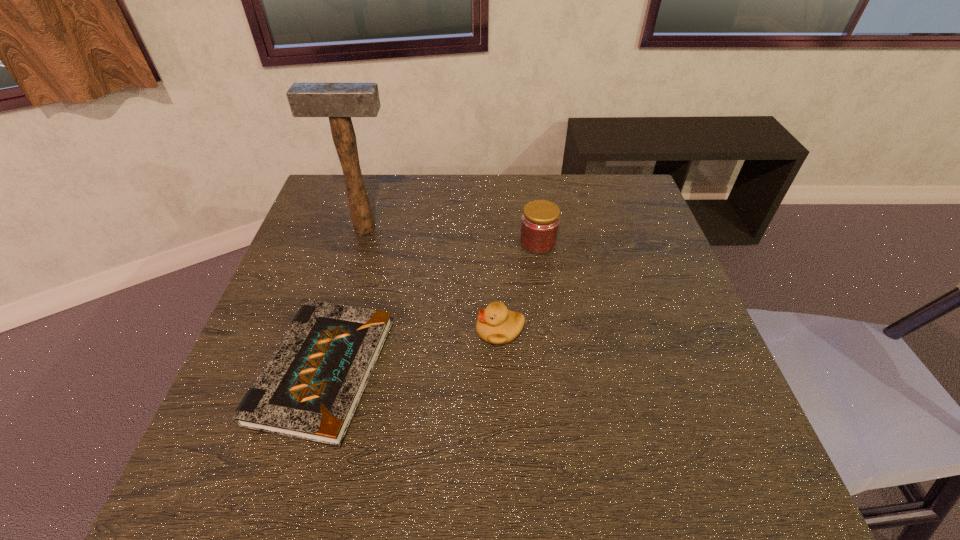
I want to click on vacant space in between the notebook and the jam, so click(x=430, y=307).

Locate which object is the second closest to the second shortest object. Please provide its 2D coordinates. Your answer should be formatted as a tuple, i.e. [(x, y)], where the tuple contains the x and y coordinates of a point satisfying the conditions above.

[(540, 221)]

This screenshot has width=960, height=540. What are the coordinates of `object that is the second closest one to the third tallest object` in the screenshot? It's located at (540, 221).

Locate an element on the screen. The image size is (960, 540). free region that satisfies the following two spatial constraints: 1. on the front side of the mallet; 2. on the right side of the shortest object is located at coordinates (322, 371).

This screenshot has height=540, width=960. Identify the location of vacant position in the image that satisfies the following two spatial constraints: 1. at the beak of the second object from right to left; 2. on the front side of the shortest object. (501, 371).

Where is `blank space that satisfies the following two spatial constraints: 1. on the back side of the rightmost object; 2. on the left side of the notebook`? blank space that satisfies the following two spatial constraints: 1. on the back side of the rightmost object; 2. on the left side of the notebook is located at coordinates (361, 243).

At what (x,y) coordinates should I click in order to perform the action: click on vacant point that satisfies the following two spatial constraints: 1. on the front side of the shortest object; 2. on the right side of the tallest object. Please return your answer as a coordinate pair (x, y). This screenshot has height=540, width=960. Looking at the image, I should click on (322, 371).

Find the location of a particular element. free spot that satisfies the following two spatial constraints: 1. on the front side of the shortest object; 2. on the left side of the mallet is located at coordinates (322, 371).

Find the location of a particular element. free space that satisfies the following two spatial constraints: 1. on the front side of the rightmost object; 2. at the beak of the second object from right to left is located at coordinates (550, 331).